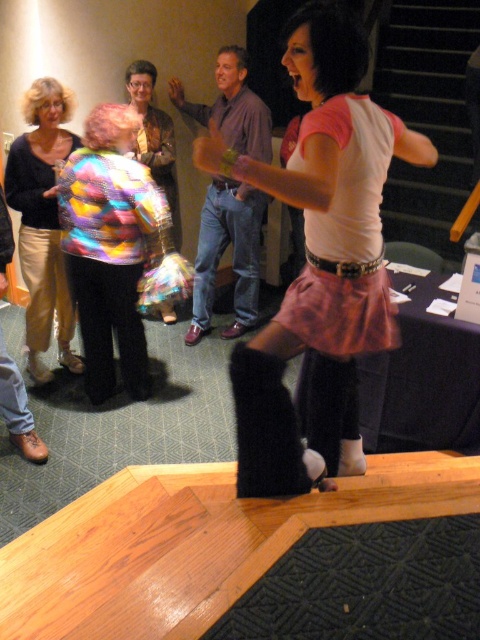
You are organizing a costume party and need to decide which jacket to wear. Both the multicolored fabric jacket at center and the rainbow sequined jacket at center are options. Based on their sizes, which one would be more suitable if you prefer a larger, more voluminous style?

The multicolored fabric jacket at center is larger in size compared to the rainbow sequined jacket at center, making it more suitable for someone who prefers a larger, more voluminous style.

You are at a community event and see two jackets hanging on a rack at the center of the room. The jackets are labeled as the multicolored fabric jacket at center and the rainbow sequined jacket at center. Which jacket is positioned to the left when facing the rack?

The multicolored fabric jacket at center is positioned to the left of the rainbow sequined jacket at center when facing the rack.

You are organizing a fashion show and need to place the matte black sweater at left and the rainbow sequined jacket at center on a runway. The runway is 1 meter wide. Can both items be displayed side by side without overlapping?

The matte black sweater at left is 94.34 centimeters away from the rainbow sequined jacket at center. Since the runway is 1 meter wide, which is 100 centimeters, there is enough space between them to display both items side by side without overlapping.